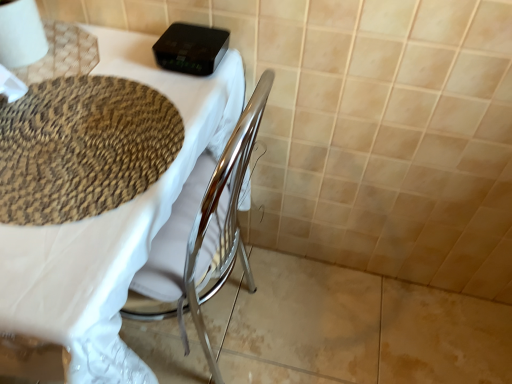
Question: From the image's perspective, is matte woven placemat at upper left above white paper at upper left?

Choices:
 (A) yes
 (B) no

Answer: (B)

Question: Considering the relative sizes of matte woven placemat at upper left and white paper at upper left in the image provided, is matte woven placemat at upper left thinner than white paper at upper left?

Choices:
 (A) yes
 (B) no

Answer: (B)

Question: Is matte woven placemat at upper left not within white paper at upper left?

Choices:
 (A) yes
 (B) no

Answer: (A)

Question: Can you confirm if matte woven placemat at upper left is shorter than white paper at upper left?

Choices:
 (A) yes
 (B) no

Answer: (B)

Question: Is matte woven placemat at upper left beside white paper at upper left?

Choices:
 (A) yes
 (B) no

Answer: (B)

Question: Considering the positions of point (94, 26) and point (5, 3), is point (94, 26) closer or farther from the camera than point (5, 3)?

Choices:
 (A) farther
 (B) closer

Answer: (A)

Question: Is matte woven placemat at upper left wider or thinner than white paper at upper left?

Choices:
 (A) wide
 (B) thin

Answer: (A)

Question: From a real-world perspective, is matte woven placemat at upper left above or below white paper at upper left?

Choices:
 (A) below
 (B) above

Answer: (A)

Question: Would you say matte woven placemat at upper left is inside or outside white paper at upper left?

Choices:
 (A) inside
 (B) outside

Answer: (B)

Question: Considering the positions of woven beige mat at upper left and white paper at upper left in the image, is woven beige mat at upper left wider or thinner than white paper at upper left?

Choices:
 (A) thin
 (B) wide

Answer: (B)

Question: Looking at the image, does woven beige mat at upper left seem bigger or smaller compared to white paper at upper left?

Choices:
 (A) big
 (B) small

Answer: (B)

Question: Is point (36, 132) positioned closer to the camera than point (8, 57)?

Choices:
 (A) closer
 (B) farther

Answer: (A)

Question: Would you say woven beige mat at upper left is to the left or to the right of white paper at upper left in the picture?

Choices:
 (A) left
 (B) right

Answer: (B)

Question: From their relative heights in the image, would you say matte woven placemat at upper left is taller or shorter than woven beige mat at upper left?

Choices:
 (A) tall
 (B) short

Answer: (A)

Question: Considering the positions of matte woven placemat at upper left and woven beige mat at upper left in the image, is matte woven placemat at upper left wider or thinner than woven beige mat at upper left?

Choices:
 (A) thin
 (B) wide

Answer: (B)